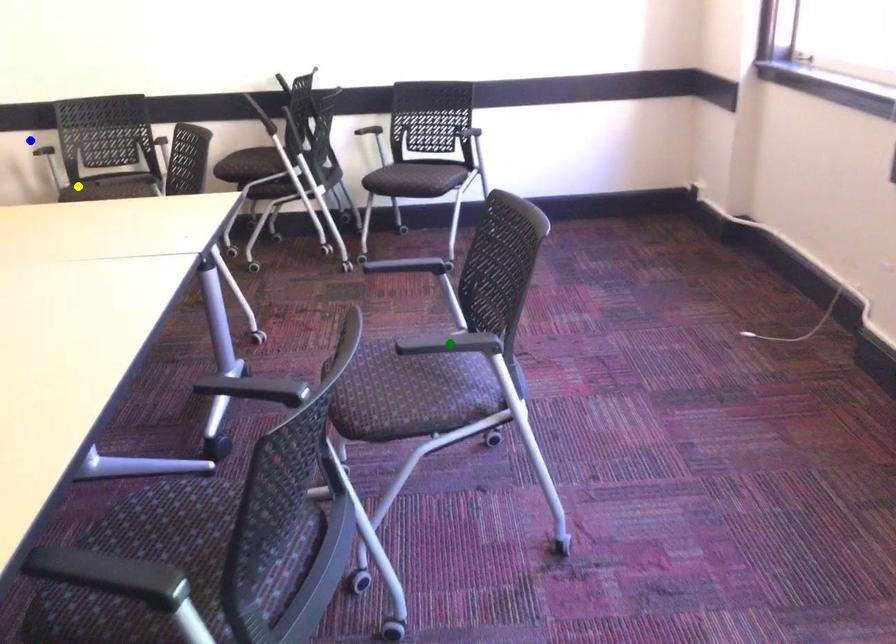
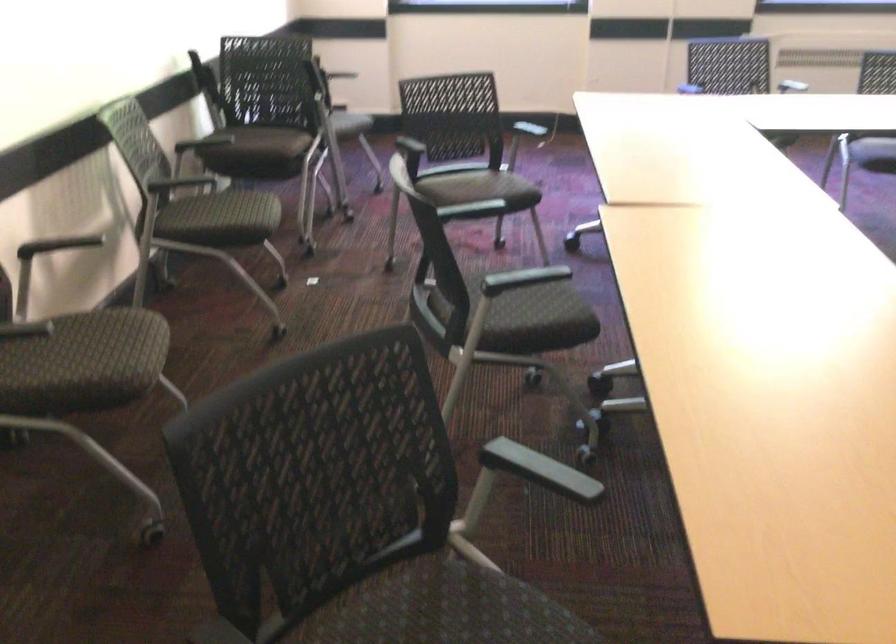
I am providing you with two images of the same scene from different viewpoints. Three points are marked in image1. Which point corresponds to a part or object that is occluded in image2?In image1, three points are marked. Which of them correspond to a part or object that is occluded in image2?Among the three points shown in image1, which one corresponds to a part or object that is no longer visible due to occlusion in image2?

Invisible in image2: green point, blue point.